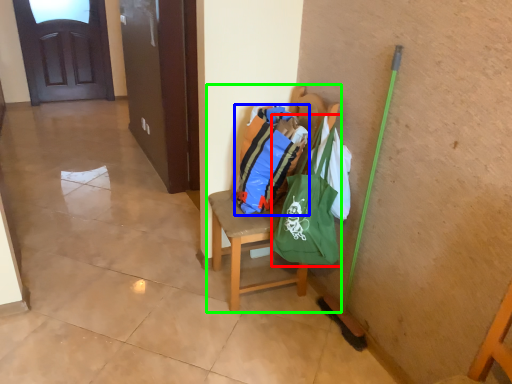
Question: Which object is positioned closest to shoulder bag (highlighted by a red box)? Select from shopping bag (highlighted by a blue box) and chair (highlighted by a green box).

Choices:
 (A) shopping bag
 (B) chair

Answer: (A)